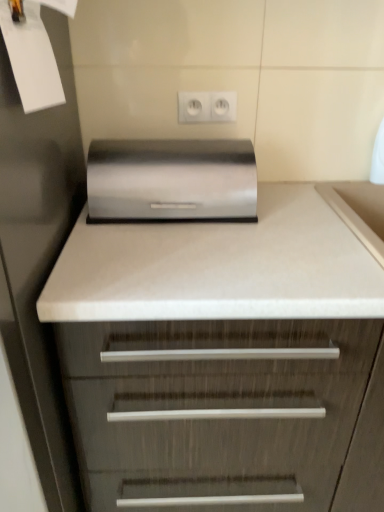
Find the location of `free space in front of satin metallic breadbox at center`. free space in front of satin metallic breadbox at center is located at coordinates (175, 261).